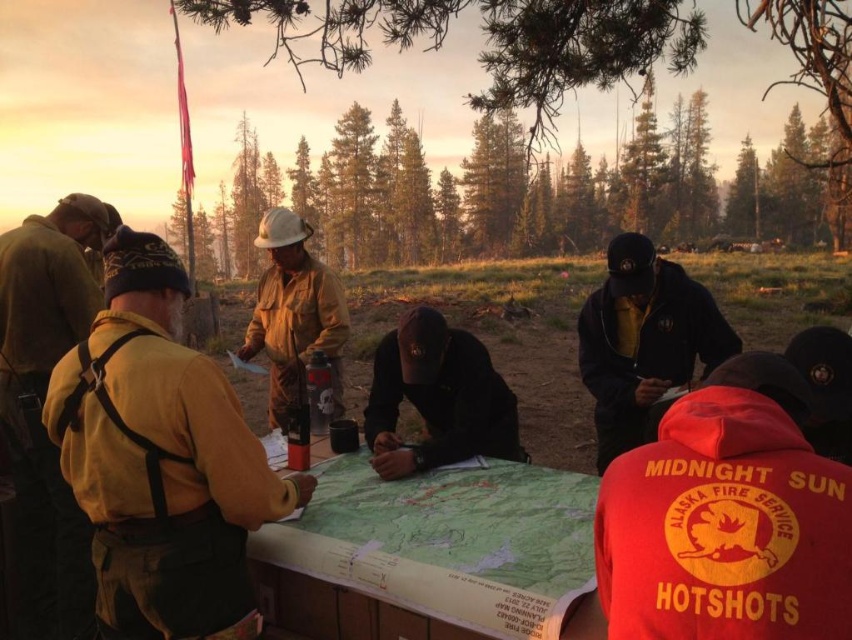
Which is in front, point (426, 308) or point (321, 285)?

Positioned in front is point (426, 308).

Is point (384, 401) in front of point (325, 348)?

Yes, it is in front of point (325, 348).

Describe the element at coordinates (436, 397) in the screenshot. I see `black matte cap at center` at that location.

The width and height of the screenshot is (852, 640). In order to click on black matte cap at center in this screenshot , I will do `click(436, 397)`.

Describe the element at coordinates (160, 460) in the screenshot. I see `yellow fabric jacket at center` at that location.

In the scene shown: Measure the distance between yellow fabric jacket at center and black matte cap at center.

They are 32.13 inches apart.

Is point (163, 358) positioned after point (469, 413)?

No, (163, 358) is closer to viewer.

The image size is (852, 640). What are the coordinates of `yellow fabric jacket at center` in the screenshot? It's located at (160, 460).

Does black matte jacket at center have a greater width compared to matte brown uniform at center?

Indeed, black matte jacket at center has a greater width compared to matte brown uniform at center.

Who is taller, black matte jacket at center or matte brown uniform at center?

black matte jacket at center

Which is in front, point (695, 317) or point (277, 342)?

Point (695, 317) is more forward.

You are a GUI agent. You are given a task and a screenshot of the screen. Output one action in this format:
    pyautogui.click(x=<x>, y=<y>)
    Task: Click on the black matte jacket at center
    
    Given the screenshot: What is the action you would take?
    pos(643,340)